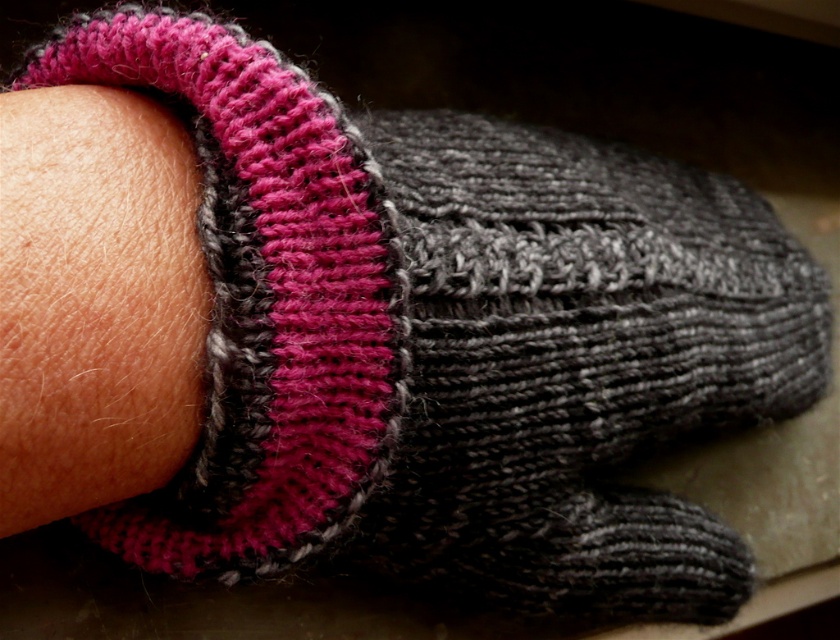
Question: Can you confirm if pink knitted wrist at lower left is thinner than fuzzy pink-gray wristband at upper left?

Choices:
 (A) no
 (B) yes

Answer: (B)

Question: Does pink knitted wrist at lower left appear on the right side of fuzzy pink-gray wristband at upper left?

Choices:
 (A) no
 (B) yes

Answer: (A)

Question: Among these objects, which one is farthest from the camera?

Choices:
 (A) fuzzy pink-gray wristband at upper left
 (B) pink knitted wrist at lower left

Answer: (A)

Question: Among these objects, which one is farthest from the camera?

Choices:
 (A) pink knitted wrist at lower left
 (B) fuzzy pink-gray wristband at upper left

Answer: (B)

Question: Among these points, which one is farthest from the camera?

Choices:
 (A) (182, 51)
 (B) (106, 104)

Answer: (B)

Question: Considering the relative positions of pink knitted wrist at lower left and fuzzy pink-gray wristband at upper left in the image provided, where is pink knitted wrist at lower left located with respect to fuzzy pink-gray wristband at upper left?

Choices:
 (A) below
 (B) above

Answer: (B)